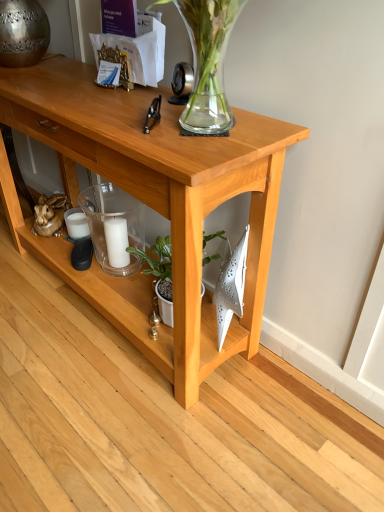
Question: From the image's perspective, would you say white matte candle at center is shown under light wood table at center?

Choices:
 (A) no
 (B) yes

Answer: (B)

Question: Can you confirm if white matte candle at center is positioned to the right of light wood table at center?

Choices:
 (A) yes
 (B) no

Answer: (A)

Question: Is white matte candle at center oriented away from light wood table at center?

Choices:
 (A) no
 (B) yes

Answer: (B)

Question: Is white matte candle at center aimed at light wood table at center?

Choices:
 (A) no
 (B) yes

Answer: (B)

Question: From a real-world perspective, is white matte candle at center located higher than light wood table at center?

Choices:
 (A) yes
 (B) no

Answer: (B)

Question: Based on their positions, is green matte plant at center located to the left or right of transparent glass candle at center?

Choices:
 (A) right
 (B) left

Answer: (A)

Question: Is green matte plant at center inside or outside of transparent glass candle at center?

Choices:
 (A) outside
 (B) inside

Answer: (A)

Question: From their relative heights in the image, would you say green matte plant at center is taller or shorter than transparent glass candle at center?

Choices:
 (A) tall
 (B) short

Answer: (B)

Question: Looking at the image, does green matte plant at center seem bigger or smaller compared to transparent glass candle at center?

Choices:
 (A) small
 (B) big

Answer: (B)

Question: From a real-world perspective, is green matte plant at center physically located above or below white matte candle at center?

Choices:
 (A) above
 (B) below

Answer: (A)

Question: Relative to white matte candle at center, is green matte plant at center in front or behind?

Choices:
 (A) behind
 (B) front

Answer: (B)

Question: Is point (157, 249) positioned closer to the camera than point (119, 252)?

Choices:
 (A) closer
 (B) farther

Answer: (A)

Question: Considering the positions of green matte plant at center and white matte candle at center in the image, is green matte plant at center wider or thinner than white matte candle at center?

Choices:
 (A) wide
 (B) thin

Answer: (A)

Question: Would you say light wood table at center is to the left or to the right of white matte candle at center in the picture?

Choices:
 (A) right
 (B) left

Answer: (B)

Question: Is light wood table at center spatially inside white matte candle at center, or outside of it?

Choices:
 (A) inside
 (B) outside

Answer: (B)